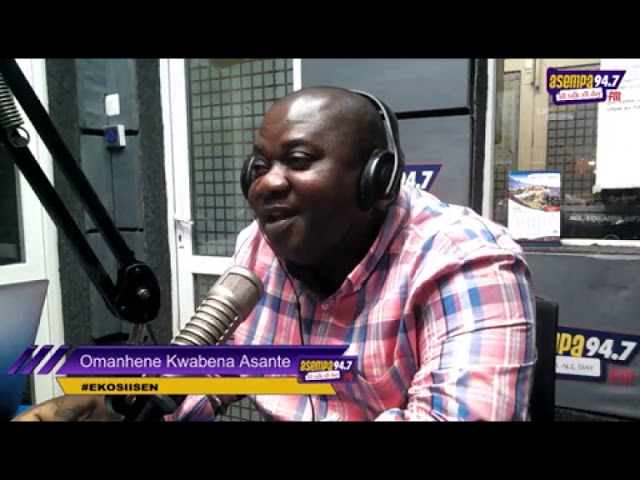
Find the location of a particular element. The image size is (640, 480). microphone arm is located at coordinates (84, 186).